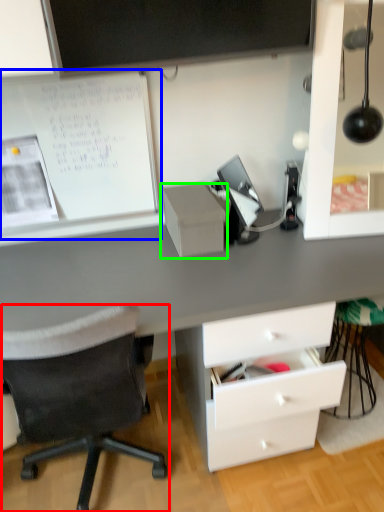
Question: Considering the real-world distances, which object is closest to chair (highlighted by a red box)? bulletin board (highlighted by a blue box) or shelf (highlighted by a green box).

Choices:
 (A) bulletin board
 (B) shelf

Answer: (B)